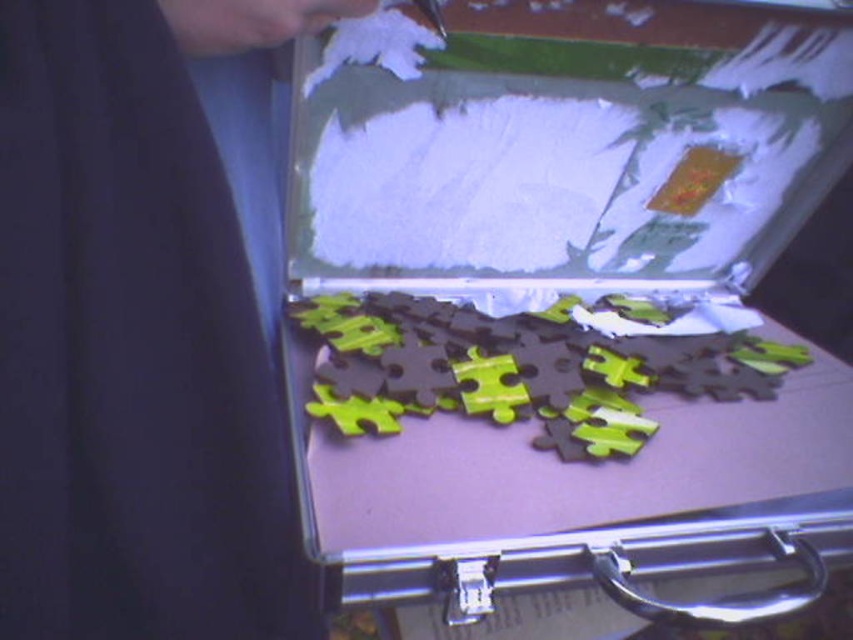
Question: Estimate the real-world distances between objects in this image. Which object is closer to the matte green puzzle pieces at center?

Choices:
 (A) dark fabric at upper left
 (B) matte plastic puzzle pieces at center

Answer: (B)

Question: Which point is farther to the camera?

Choices:
 (A) dark fabric at upper left
 (B) matte green puzzle pieces at center
 (C) matte plastic puzzle pieces at center

Answer: (B)

Question: Where is matte plastic puzzle pieces at center located in relation to dark fabric at upper left in the image?

Choices:
 (A) left
 (B) right

Answer: (B)

Question: Can you confirm if dark fabric at upper left is positioned below matte green puzzle pieces at center?

Choices:
 (A) yes
 (B) no

Answer: (B)

Question: Which point is closer to the camera taking this photo?

Choices:
 (A) (689, 342)
 (B) (91, 484)
 (C) (576, 492)

Answer: (B)

Question: Is dark fabric at upper left bigger than matte green puzzle pieces at center?

Choices:
 (A) yes
 (B) no

Answer: (B)